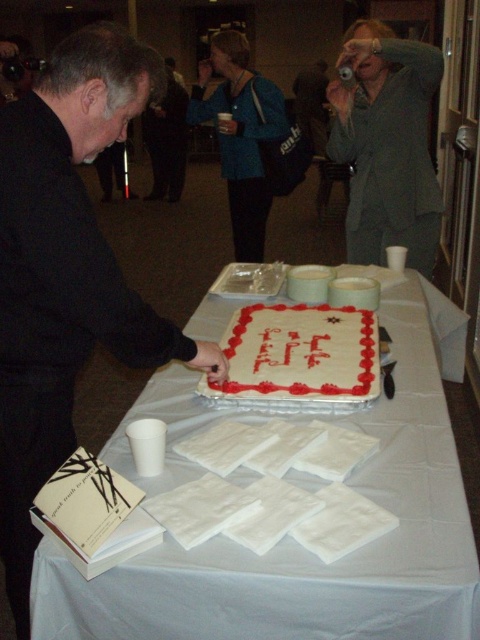
Question: Can you confirm if black matte jacket at center is positioned above gray wool sweater at upper right?

Choices:
 (A) no
 (B) yes

Answer: (A)

Question: Which point is closer to the camera?

Choices:
 (A) black matte jacket at center
 (B) gray wool sweater at upper right

Answer: (A)

Question: Is the position of white paper napkins at center less distant than that of gray wool sweater at upper right?

Choices:
 (A) yes
 (B) no

Answer: (A)

Question: Can you confirm if white paper napkins at center is positioned below black matte jacket at center?

Choices:
 (A) yes
 (B) no

Answer: (A)

Question: Which point is closer to the camera?

Choices:
 (A) pos(98,612)
 (B) pos(352,44)

Answer: (A)

Question: Which point is farther from the camera taking this photo?

Choices:
 (A) (262, 362)
 (B) (419, 234)
 (C) (97, 310)
 (D) (100, 456)

Answer: (B)